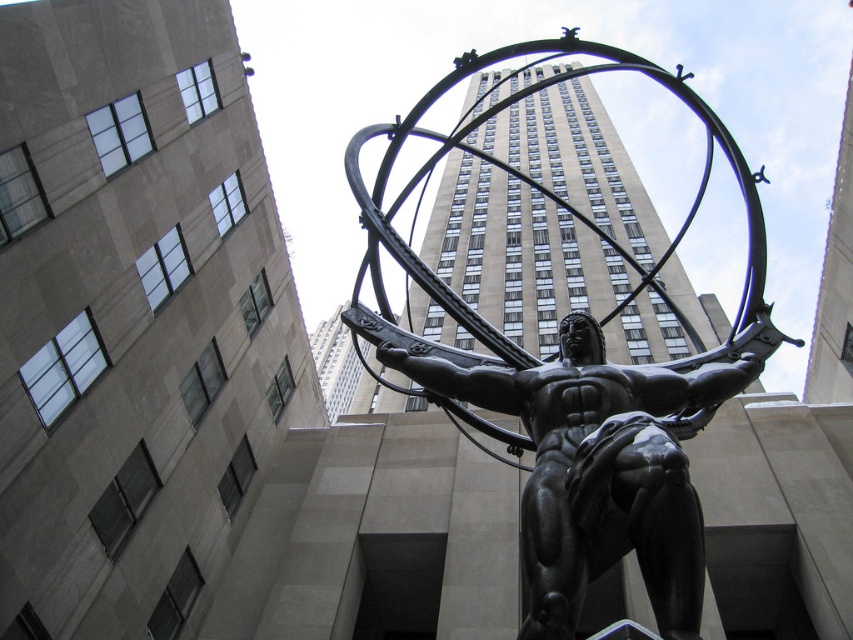
You are a tourist standing at the point marked by the coordinates (575,381) in the image. Which object in the scene is directly in front of you?

The bronze statue at center is directly in front of you as the point marks its location.